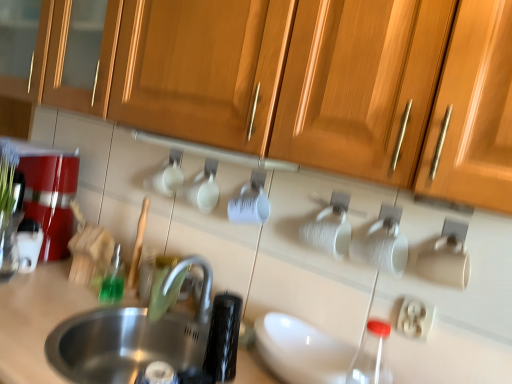
Question: Is wooden cabinet at upper center closer to the viewer compared to stainless steel sink at lower left?

Choices:
 (A) no
 (B) yes

Answer: (B)

Question: From the image's perspective, is wooden cabinet at upper center below stainless steel sink at lower left?

Choices:
 (A) no
 (B) yes

Answer: (A)

Question: Is wooden cabinet at upper center to the left of stainless steel sink at lower left from the viewer's perspective?

Choices:
 (A) yes
 (B) no

Answer: (B)

Question: Is stainless steel sink at lower left surrounded by wooden cabinet at upper center?

Choices:
 (A) yes
 (B) no

Answer: (B)

Question: From a real-world perspective, is wooden cabinet at upper center on stainless steel sink at lower left?

Choices:
 (A) no
 (B) yes

Answer: (B)

Question: Can you confirm if wooden cabinet at upper center is taller than stainless steel sink at lower left?

Choices:
 (A) yes
 (B) no

Answer: (A)

Question: Would you say metallic red coffee machine at left is a long distance from stainless steel sink at lower left?

Choices:
 (A) yes
 (B) no

Answer: (B)

Question: Is metallic red coffee machine at left closer to the viewer compared to stainless steel sink at lower left?

Choices:
 (A) no
 (B) yes

Answer: (A)

Question: Is stainless steel sink at lower left inside metallic red coffee machine at left?

Choices:
 (A) no
 (B) yes

Answer: (A)

Question: From the image's perspective, is metallic red coffee machine at left above stainless steel sink at lower left?

Choices:
 (A) no
 (B) yes

Answer: (B)

Question: Does metallic red coffee machine at left have a smaller size compared to stainless steel sink at lower left?

Choices:
 (A) yes
 (B) no

Answer: (B)

Question: Does metallic red coffee machine at left come behind stainless steel sink at lower left?

Choices:
 (A) no
 (B) yes

Answer: (B)

Question: Does metallic red coffee machine at left have a greater width compared to green translucent bottle at left?

Choices:
 (A) no
 (B) yes

Answer: (B)